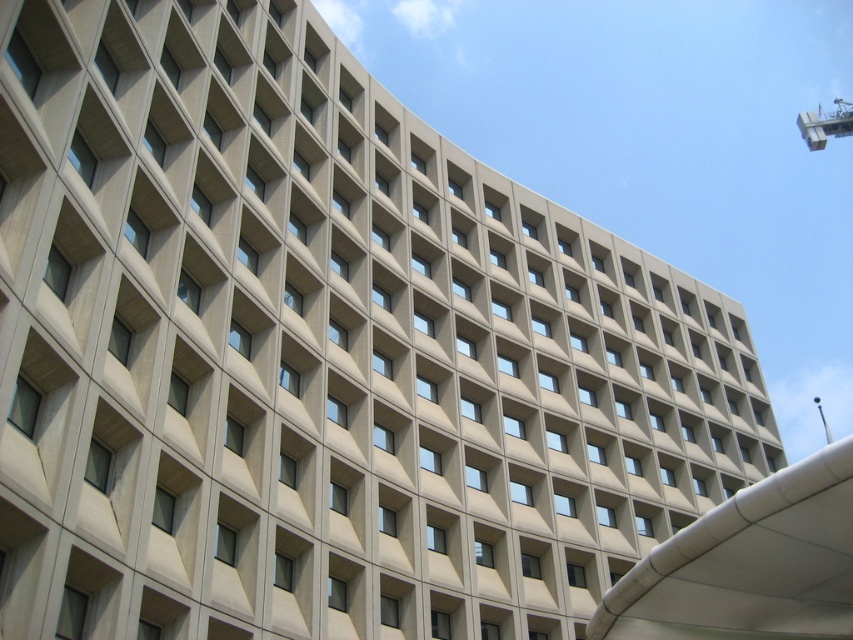
You are standing at the base of the building and want to take the lift to the top floor. However, there is a metallic crane at upper right blocking your path. Can you reach the white matte lift at lower right without going around the crane?

The white matte lift at lower right is to the left of the metallic crane at upper right, so you can reach the white matte lift at lower right without going around the crane as it is positioned to the left side of the crane.

You are standing at the bottom of the building and want to take the white matte lift at lower right to reach the upper floors. Based on its position, can you estimate how far to the right you should walk from the building entrance to find the lift?

The white matte lift at lower right is located at coordinates approximately 0.883 on the x and 0.879 on the y axis, which means it is positioned near the right edge of the building. Therefore, you should walk towards the far right side of the entrance area to locate the lift.

You are an architect designing a new building. You want to place a small garden between the white matte lift at lower right and the metallic crane at upper right. Is there enough space for the garden?

The white matte lift at lower right occupies less space than the metallic crane at upper right, so there might be enough space between them to place a small garden.